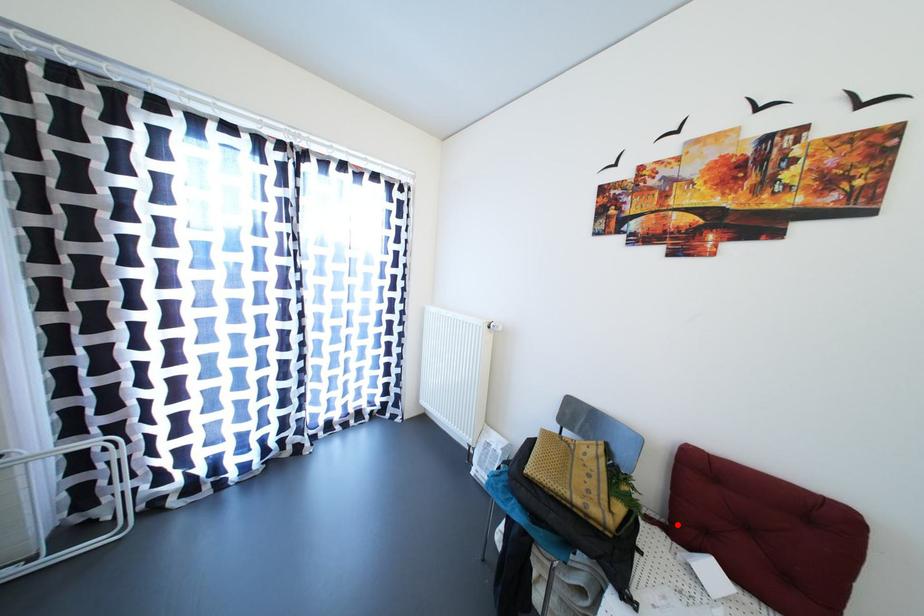
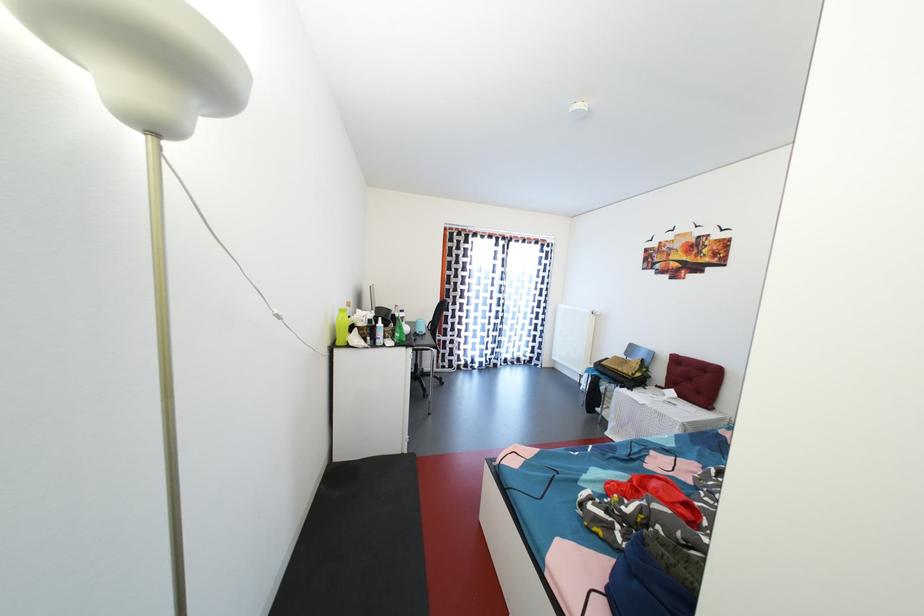
Question: I am providing you with two images of the same scene from different viewpoints. A red point is marked on the first image. Can you still see the location of the red point in image 2?

Choices:
 (A) Yes
 (B) No

Answer: (B)